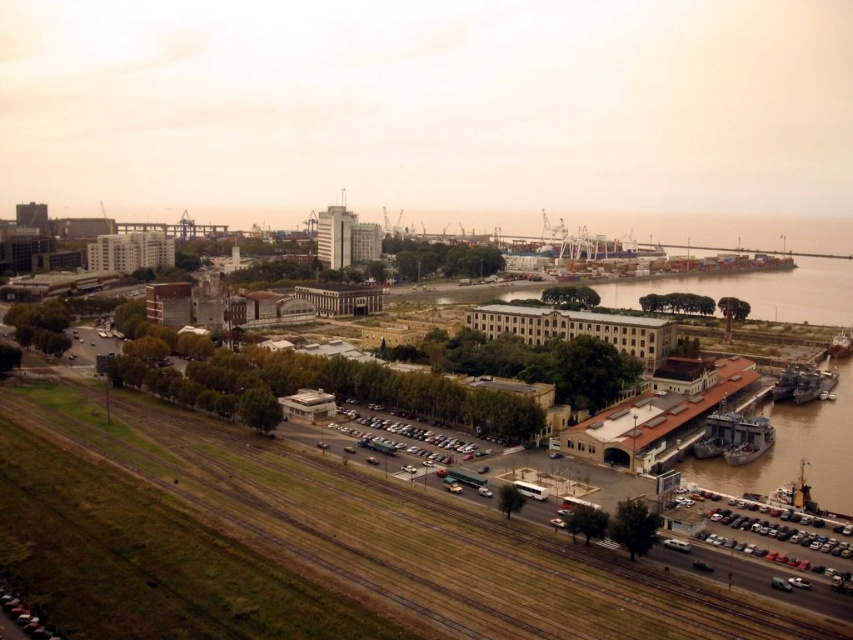
Question: Can you confirm if brown grassy train track at lower left is bigger than metallic gray ship at lower right?

Choices:
 (A) yes
 (B) no

Answer: (A)

Question: Which point is closer to the camera?

Choices:
 (A) (741, 461)
 (B) (776, 387)
 (C) (161, 435)
 (D) (846, 330)

Answer: (A)

Question: Does metallic gray ship at lower right come behind metallic silver boat at right?

Choices:
 (A) no
 (B) yes

Answer: (A)

Question: Which point is farther to the camera?

Choices:
 (A) (817, 385)
 (B) (751, 429)
 (C) (846, 353)

Answer: (C)

Question: Estimate the real-world distances between objects in this image. Which object is closer to the brown grassy train track at lower left?

Choices:
 (A) metallic silver boat at right
 (B) metallic gray ship at lower right
 (C) shiny metallic ship at lower right

Answer: (B)

Question: Is the position of metallic gray ship at lower right less distant than that of shiny metallic ship at lower right?

Choices:
 (A) yes
 (B) no

Answer: (A)